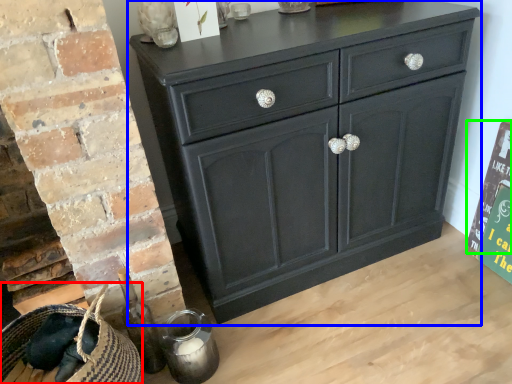
Question: Which is nearer to the basket (highlighted by a red box)? chest of drawers (highlighted by a blue box) or bulletin board (highlighted by a green box).

Choices:
 (A) chest of drawers
 (B) bulletin board

Answer: (A)